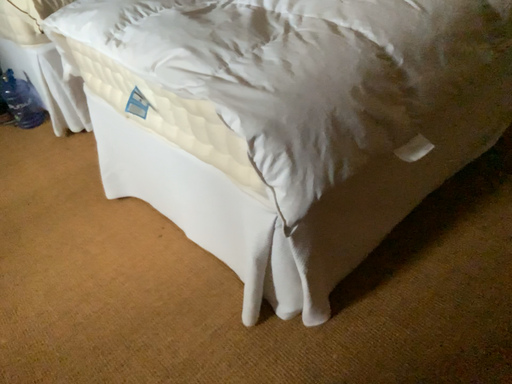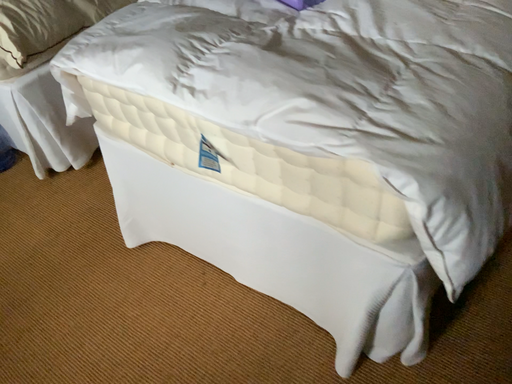
Question: How did the camera likely rotate when shooting the video?

Choices:
 (A) rotated left
 (B) rotated right

Answer: (B)